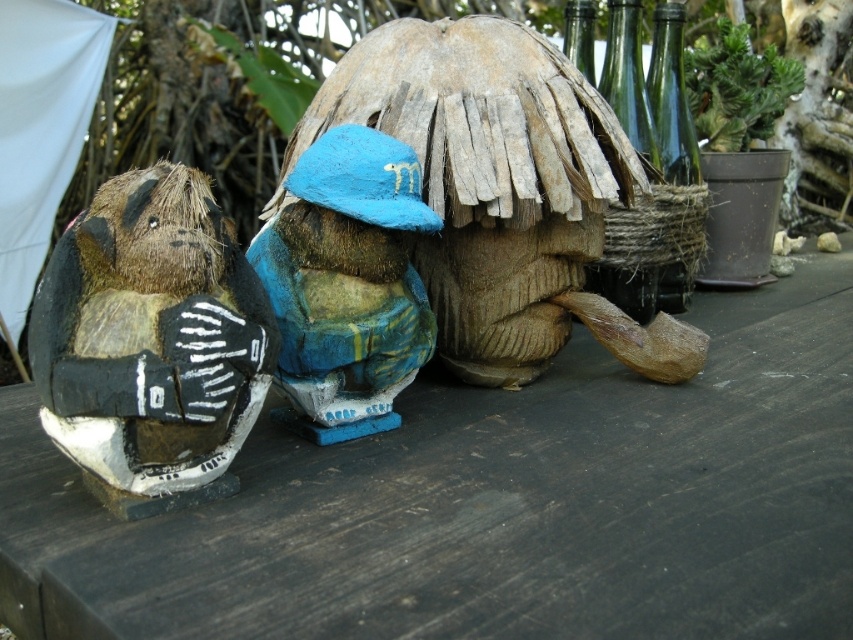
You are a delivery person who needs to place a package between the fuzzy brown plush at left and the green leafy plant at upper center. The package requires a space of 3 feet. Can you fit it there?

The fuzzy brown plush at left is 3.56 feet away from the green leafy plant at upper center. Since the required space is 3 feet, the package can be placed between them as the distance is sufficient.